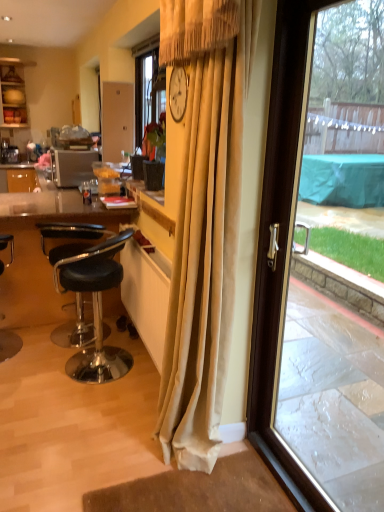
Question: Is matte wood cabinet at upper left bigger than transparent glass door at right?

Choices:
 (A) no
 (B) yes

Answer: (B)

Question: Considering the relative sizes of matte wood cabinet at upper left and transparent glass door at right in the image provided, is matte wood cabinet at upper left wider than transparent glass door at right?

Choices:
 (A) no
 (B) yes

Answer: (B)

Question: Is matte wood cabinet at upper left located outside transparent glass door at right?

Choices:
 (A) no
 (B) yes

Answer: (B)

Question: Is matte wood cabinet at upper left at the left side of transparent glass door at right?

Choices:
 (A) no
 (B) yes

Answer: (B)

Question: From a real-world perspective, is matte wood cabinet at upper left on transparent glass door at right?

Choices:
 (A) no
 (B) yes

Answer: (B)

Question: Is matte wood cabinet at upper left turned away from transparent glass door at right?

Choices:
 (A) yes
 (B) no

Answer: (B)

Question: From the image's perspective, is beige velvet curtain at center beneath transparent glass door at right?

Choices:
 (A) no
 (B) yes

Answer: (A)

Question: Can you confirm if beige velvet curtain at center is smaller than transparent glass door at right?

Choices:
 (A) yes
 (B) no

Answer: (B)

Question: Does beige velvet curtain at center appear on the right side of transparent glass door at right?

Choices:
 (A) yes
 (B) no

Answer: (B)

Question: Does beige velvet curtain at center touch transparent glass door at right?

Choices:
 (A) no
 (B) yes

Answer: (A)

Question: Does beige velvet curtain at center have a greater height compared to transparent glass door at right?

Choices:
 (A) yes
 (B) no

Answer: (A)

Question: Does beige velvet curtain at center turn towards transparent glass door at right?

Choices:
 (A) no
 (B) yes

Answer: (A)

Question: From the image's perspective, is black leather stool at lower left, the 1th chair from the left, under beige velvet curtain at center?

Choices:
 (A) yes
 (B) no

Answer: (A)